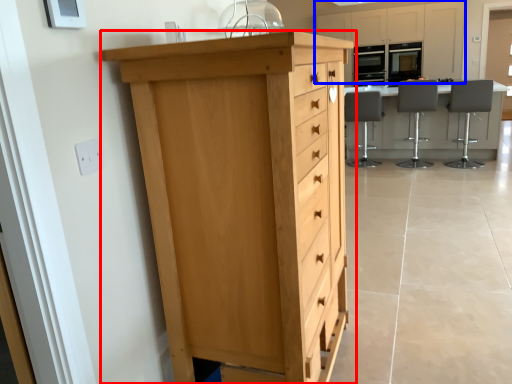
Question: Which object appears farthest to the camera in this image, chest of drawers (highlighted by a red box) or cabinetry (highlighted by a blue box)?

Choices:
 (A) chest of drawers
 (B) cabinetry

Answer: (B)